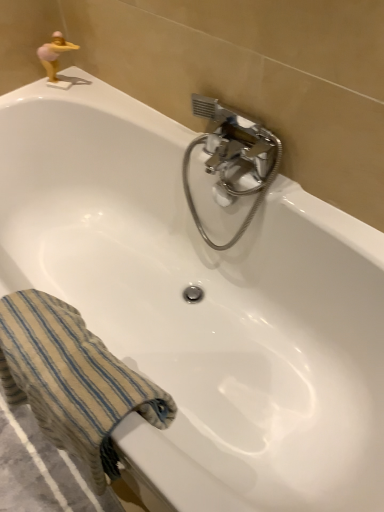
This screenshot has width=384, height=512. I want to click on vacant space to the right of gold plastic figurine at upper left, so click(x=105, y=94).